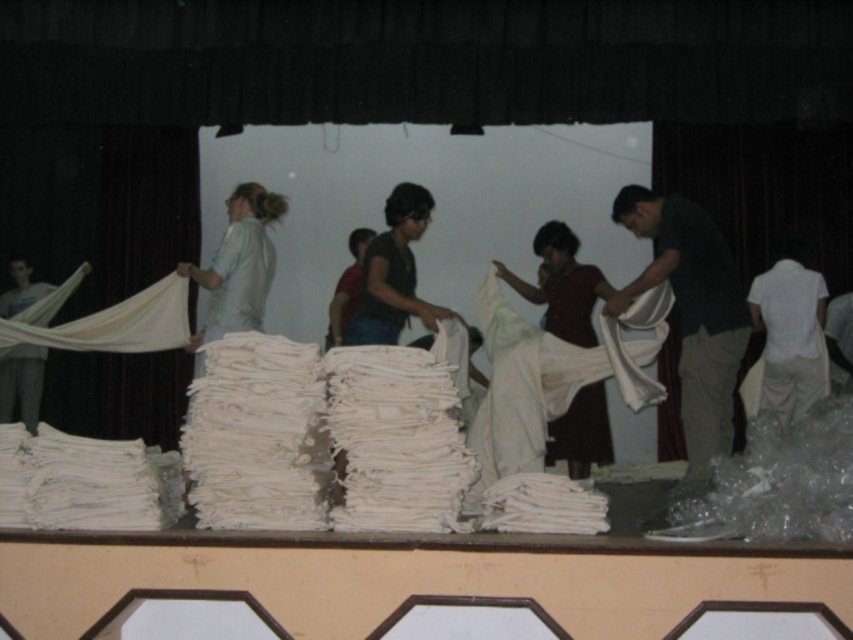
You need to pack these items into a suitcase. Given that the white cotton shirt at right and the matte gray pants at left are both folded, which item would require more space in the suitcase?

The white cotton shirt at right requires more space in the suitcase because it has a larger size compared to the matte gray pants at left.

You are standing at the center of the stage and want to reach both the point at coordinates point (561, 248) and the point at coordinates point (820, 291). Which point will you reach first if you move straight towards them?

You will reach point (561, 248) first because it is closer to you than point (820, 291), which is further away.